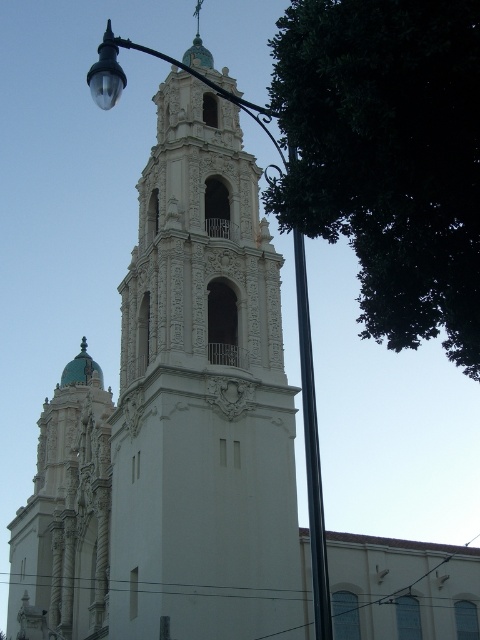
Can you confirm if white stone tower at center is smaller than black metal pole at center?

No, white stone tower at center is not smaller than black metal pole at center.

Is white stone tower at center to the left of black metal pole at center from the viewer's perspective?

Correct, you'll find white stone tower at center to the left of black metal pole at center.

The image size is (480, 640). What do you see at coordinates (203, 392) in the screenshot?
I see `white stone tower at center` at bounding box center [203, 392].

At what (x,y) coordinates should I click in order to perform the action: click on white stone tower at center. Please return your answer as a coordinate pair (x, y). Looking at the image, I should click on (203, 392).

Can you confirm if white stone tower at center is thinner than green leafy tree at upper right?

In fact, white stone tower at center might be wider than green leafy tree at upper right.

Who is shorter, white stone tower at center or green leafy tree at upper right?

green leafy tree at upper right is shorter.

I want to click on white stone tower at center, so click(x=203, y=392).

Find the location of a particular element. The image size is (480, 640). white stone tower at center is located at coordinates (203, 392).

Does green leafy tree at upper right appear on the left side of black metal pole at center?

No, green leafy tree at upper right is not to the left of black metal pole at center.

How much distance is there between green leafy tree at upper right and black metal pole at center?

green leafy tree at upper right and black metal pole at center are 21.54 feet apart from each other.

Between point (428, 324) and point (299, 243), which one is positioned in front?

Positioned in front is point (299, 243).

Locate an element on the screen. The width and height of the screenshot is (480, 640). green leafy tree at upper right is located at coordinates (387, 156).